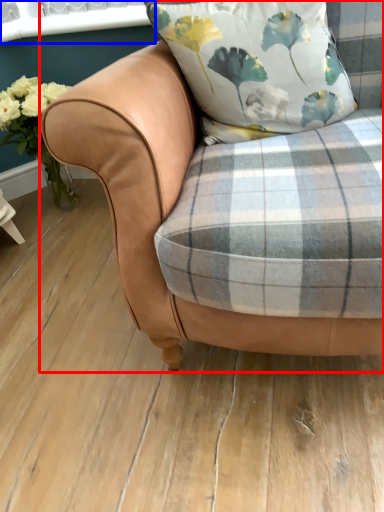
Question: Which point is closer to the camera, chair (highlighted by a red box) or window screen (highlighted by a blue box)?

Choices:
 (A) chair
 (B) window screen

Answer: (A)